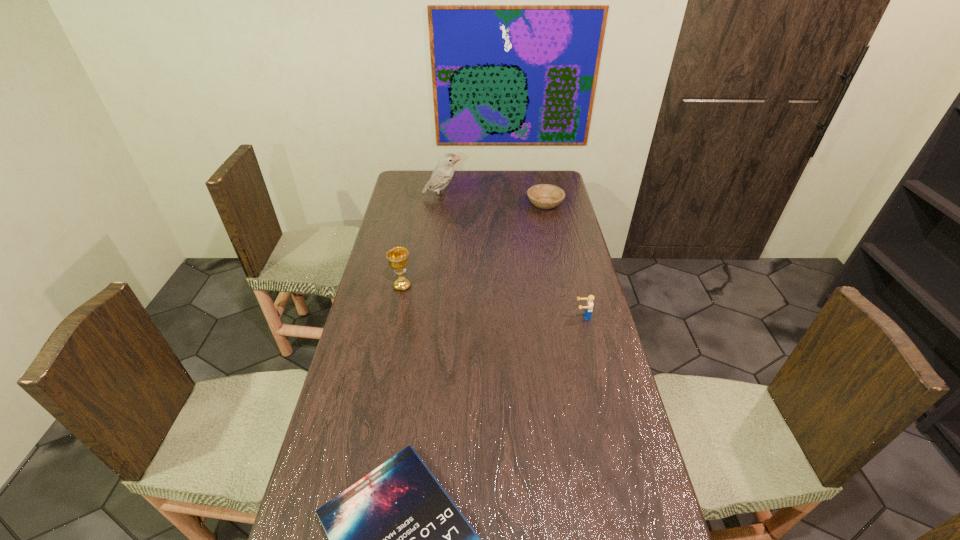
I want to click on blank space located on the face of the Lego, so tap(482, 316).

Locate an element on the screen. Image resolution: width=960 pixels, height=540 pixels. free region located on the left of the second shortest object is located at coordinates (507, 204).

Locate an element on the screen. This screenshot has width=960, height=540. object at the far edge is located at coordinates pyautogui.click(x=444, y=171).

At what (x,y) coordinates should I click in order to perform the action: click on bird that is at the left edge. Please return your answer as a coordinate pair (x, y). Looking at the image, I should click on (444, 171).

Find the location of a particular element. chalice located at the left edge is located at coordinates (398, 259).

At what (x,y) coordinates should I click in order to perform the action: click on Lego at the right edge. Please return your answer as a coordinate pair (x, y). This screenshot has height=540, width=960. Looking at the image, I should click on (589, 304).

Where is `bowl located in the right edge section of the desktop`? Image resolution: width=960 pixels, height=540 pixels. bowl located in the right edge section of the desktop is located at coordinates (544, 196).

The height and width of the screenshot is (540, 960). Identify the location of object that is at the far left corner. (444, 171).

Locate an element on the screen. This screenshot has height=540, width=960. vacant space at the far edge of the desktop is located at coordinates (498, 187).

Locate an element on the screen. The width and height of the screenshot is (960, 540). free space at the left edge is located at coordinates (371, 327).